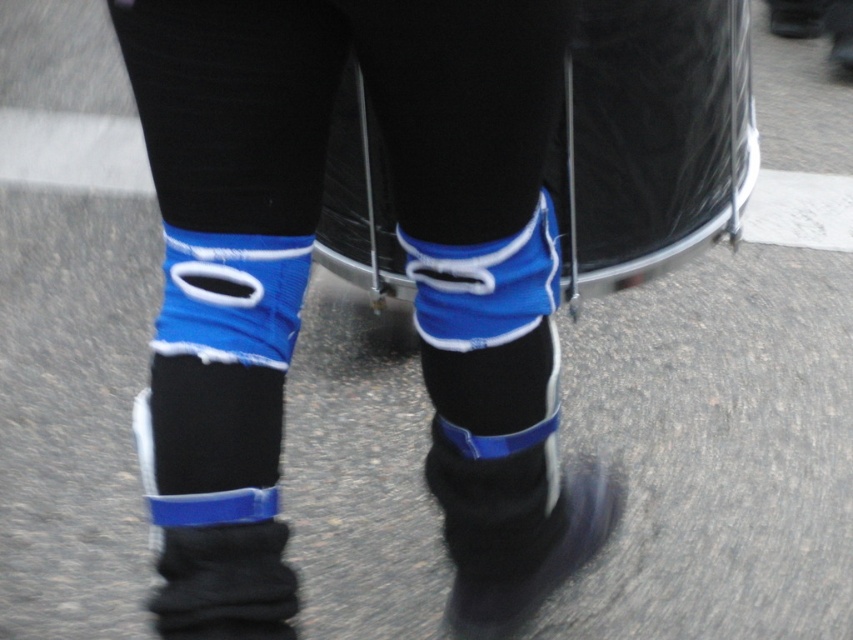
Which of these two, blue fabric leg warmers at center or black matte boot at lower center, stands shorter?

black matte boot at lower center is shorter.

Which is behind, point (434, 193) or point (467, 630)?

The point (467, 630) is behind.

Is point (549, 49) closer to viewer compared to point (576, 483)?

Yes, it is in front of point (576, 483).

This screenshot has width=853, height=640. I want to click on blue fabric leg warmers at center, so click(308, 273).

Is blue fabric leg warmers at center to the right of black knitted socks at lower left from the viewer's perspective?

Indeed, blue fabric leg warmers at center is positioned on the right side of black knitted socks at lower left.

The image size is (853, 640). Find the location of `blue fabric leg warmers at center`. blue fabric leg warmers at center is located at coordinates (308, 273).

Consider the image. Who is more distant from viewer, (262, 230) or (221, 598)?

The point (262, 230) is more distant.

I want to click on blue fabric leg warmers at center, so click(308, 273).

Does black knitted socks at lower left appear on the right side of black matte boot at lower center?

No, black knitted socks at lower left is not to the right of black matte boot at lower center.

Can you confirm if black knitted socks at lower left is positioned below black matte boot at lower center?

No.

The height and width of the screenshot is (640, 853). I want to click on black knitted socks at lower left, so click(224, 582).